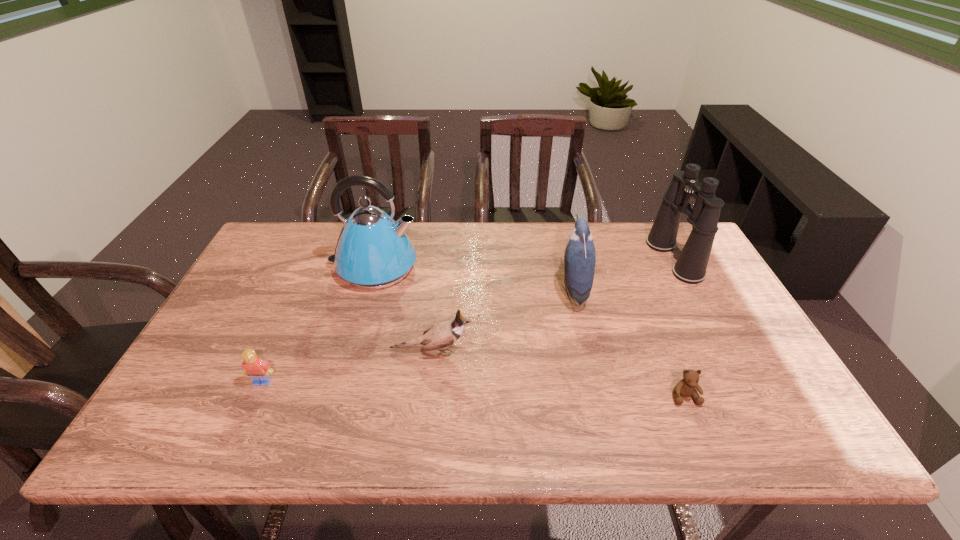
Where is `vacant space that satisfies the following two spatial constraints: 1. at the face of the left bird; 2. on the front-facing side of the leftmost object`? The image size is (960, 540). vacant space that satisfies the following two spatial constraints: 1. at the face of the left bird; 2. on the front-facing side of the leftmost object is located at coordinates (428, 382).

I want to click on vacant space that satisfies the following two spatial constraints: 1. at the tip of the fourth object from left to right's beak; 2. on the front-facing side of the second shortest object, so click(594, 382).